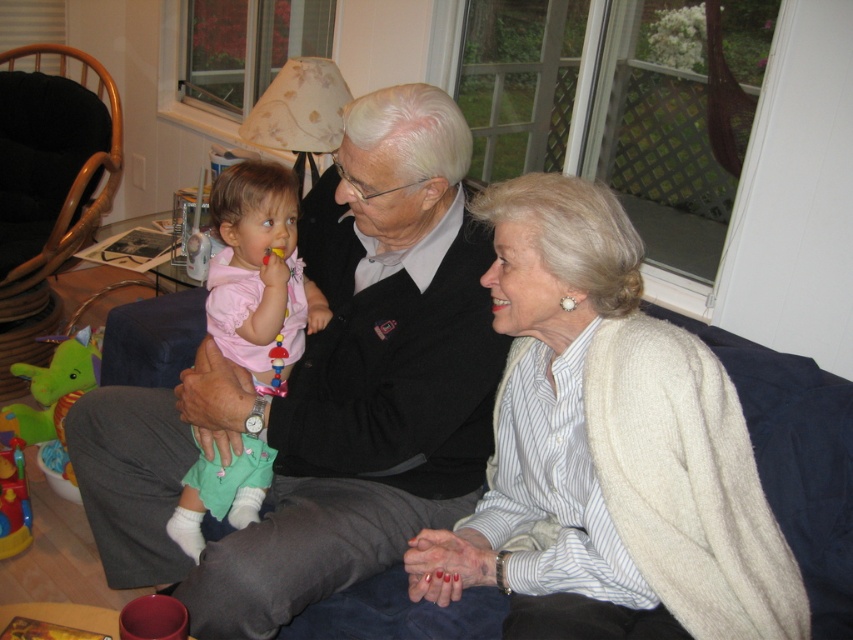
Measure the distance between matte black sweater at center and green plush dinosaur at left.

37.36 inches

Does matte black sweater at center have a greater width compared to green plush dinosaur at left?

Correct, the width of matte black sweater at center exceeds that of green plush dinosaur at left.

Image resolution: width=853 pixels, height=640 pixels. In order to click on matte black sweater at center in this screenshot , I will do `click(323, 392)`.

What are the coordinates of `matte black sweater at center` in the screenshot? It's located at (323, 392).

Which is above, matte black sweater at center or plastic/smooth toy at center?

plastic/smooth toy at center

Can you confirm if matte black sweater at center is wider than plastic/smooth toy at center?

Correct, the width of matte black sweater at center exceeds that of plastic/smooth toy at center.

Who is more forward, (459,483) or (279,353)?

Point (459,483) is in front.

Where is `matte black sweater at center`? This screenshot has width=853, height=640. matte black sweater at center is located at coordinates (323, 392).

Between pink fabric baby at left and rubberized plastic toy at lower left, which one appears on the left side from the viewer's perspective?

rubberized plastic toy at lower left

Which is behind, point (212, 483) or point (15, 449)?

Point (15, 449)

At what (x,y) coordinates should I click in order to perform the action: click on pink fabric baby at left. Please return your answer as a coordinate pair (x, y). The height and width of the screenshot is (640, 853). Looking at the image, I should click on (259, 269).